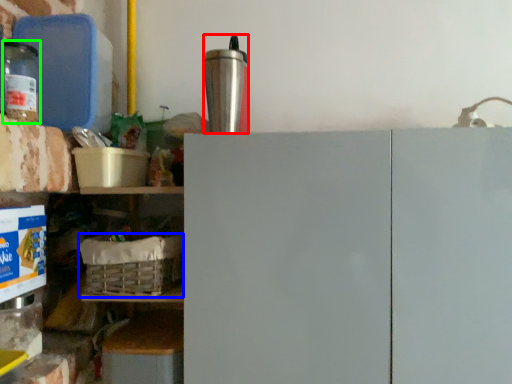
Question: Estimate the real-world distances between objects in this image. Which object is closer to appliance (highlighted by a red box), basket (highlighted by a blue box) or bottle (highlighted by a green box)?

Choices:
 (A) basket
 (B) bottle

Answer: (A)